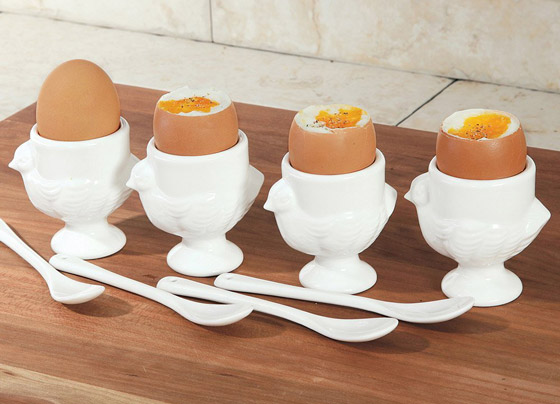
You are a GUI agent. You are given a task and a screenshot of the screen. Output one action in this format:
    pyautogui.click(x=<x>, y=<y>)
    Task: Click on the serving dish
    The image size is (560, 404).
    Given the screenshot: What is the action you would take?
    pyautogui.click(x=491, y=208), pyautogui.click(x=354, y=206), pyautogui.click(x=212, y=180), pyautogui.click(x=63, y=170)